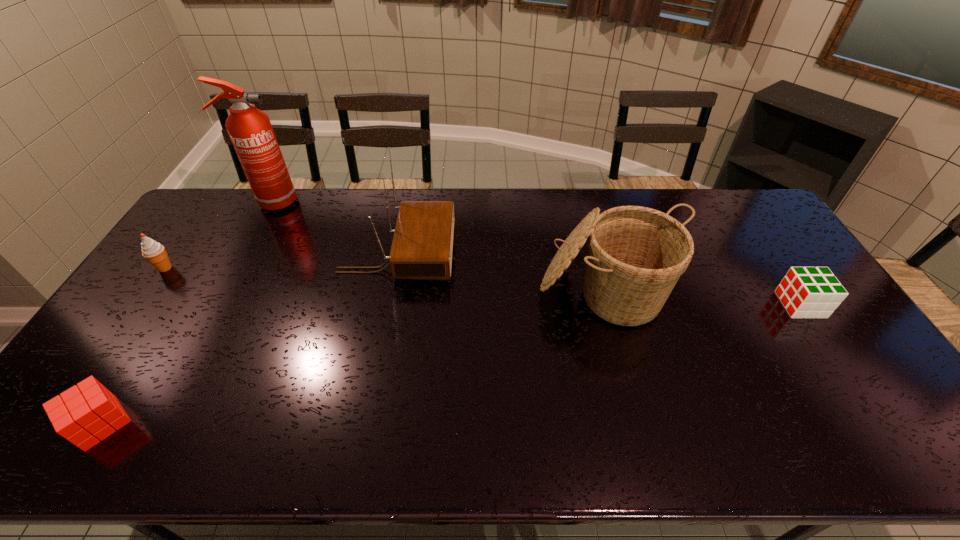
Locate an element on the screen. This screenshot has width=960, height=540. fire extinguisher is located at coordinates (250, 130).

The width and height of the screenshot is (960, 540). I want to click on the tallest object, so click(250, 130).

Where is `the third object from right to left`? Image resolution: width=960 pixels, height=540 pixels. the third object from right to left is located at coordinates (422, 245).

The width and height of the screenshot is (960, 540). I want to click on the fifth object from left to right, so click(x=636, y=255).

What are the coordinates of `the leftmost object` in the screenshot? It's located at (154, 252).

Where is `the third shortest object`? the third shortest object is located at coordinates (154, 252).

Locate an element on the screen. The image size is (960, 540). the rightmost object is located at coordinates (806, 292).

Where is `the right cube`? Image resolution: width=960 pixels, height=540 pixels. the right cube is located at coordinates (806, 292).

At what (x,y) coordinates should I click in order to perform the action: click on the left cube. Please return your answer as a coordinate pair (x, y). This screenshot has height=540, width=960. Looking at the image, I should click on (84, 415).

This screenshot has height=540, width=960. Find the location of `the nearer cube`. the nearer cube is located at coordinates (84, 415).